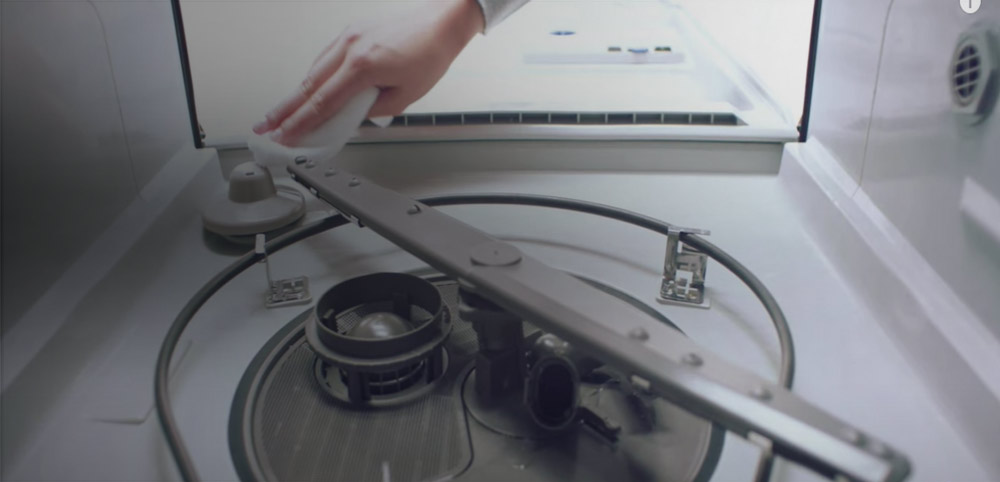
You are a GUI agent. You are given a task and a screenshot of the screen. Output one action in this format:
    pyautogui.click(x=<x>, y=<y>)
    Task: Click on the circular heating element
    Image resolution: width=1000 pixels, height=482 pixels.
    Given the screenshot: What is the action you would take?
    pyautogui.click(x=726, y=260)